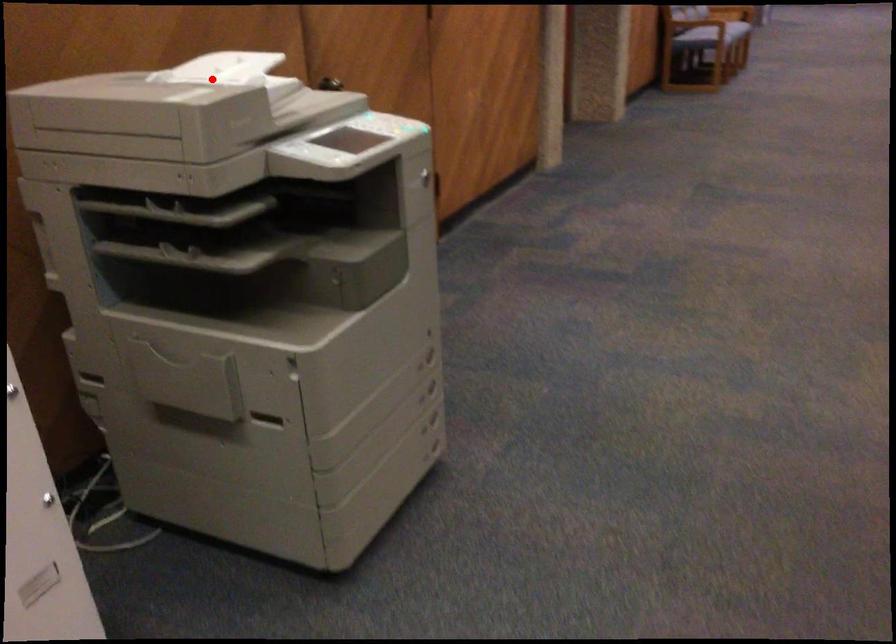
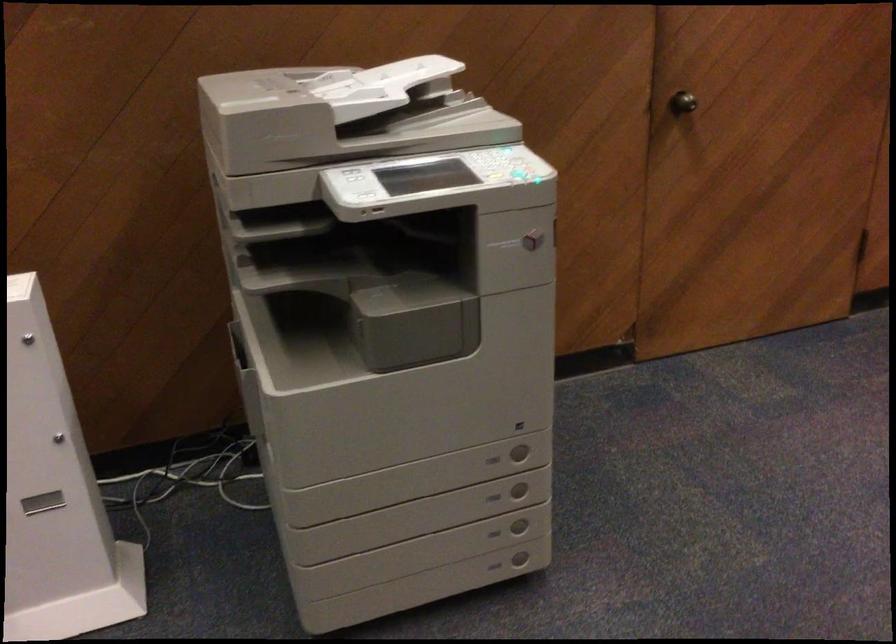
The point at the highlighted location is marked in the first image. Where is the corresponding point in the second image?

(376, 86)